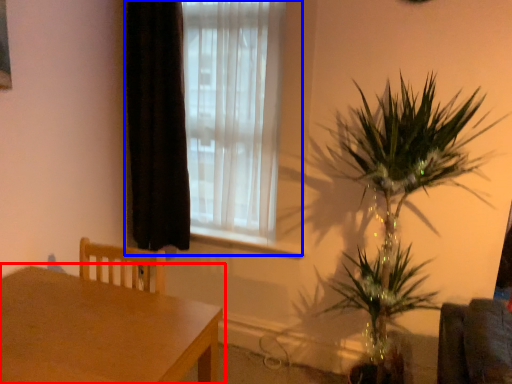
Question: Which object is closer to the camera taking this photo, table (highlighted by a red box) or window (highlighted by a blue box)?

Choices:
 (A) table
 (B) window

Answer: (A)